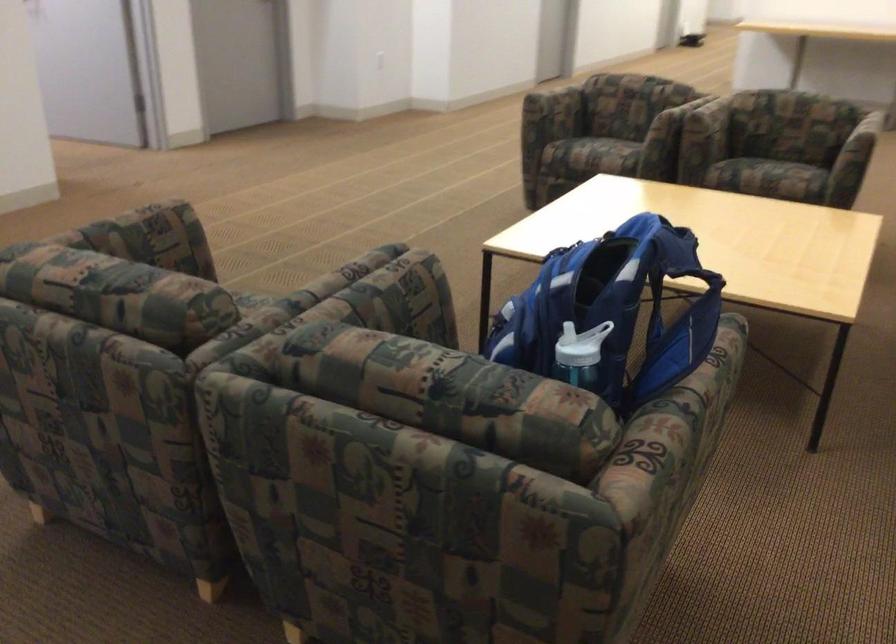
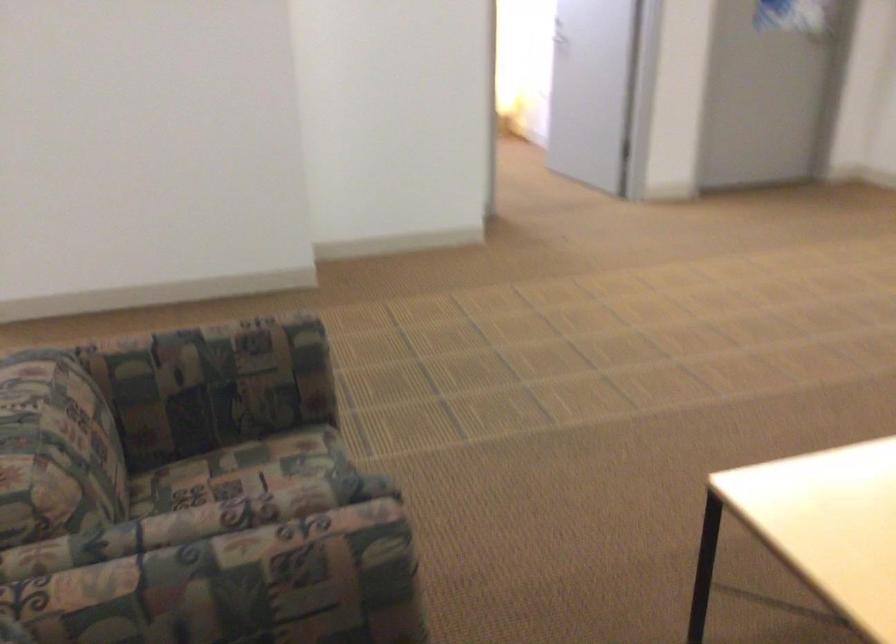
Locate, in the second image, the point that corresponds to pixel 134 234 in the first image.

(218, 351)